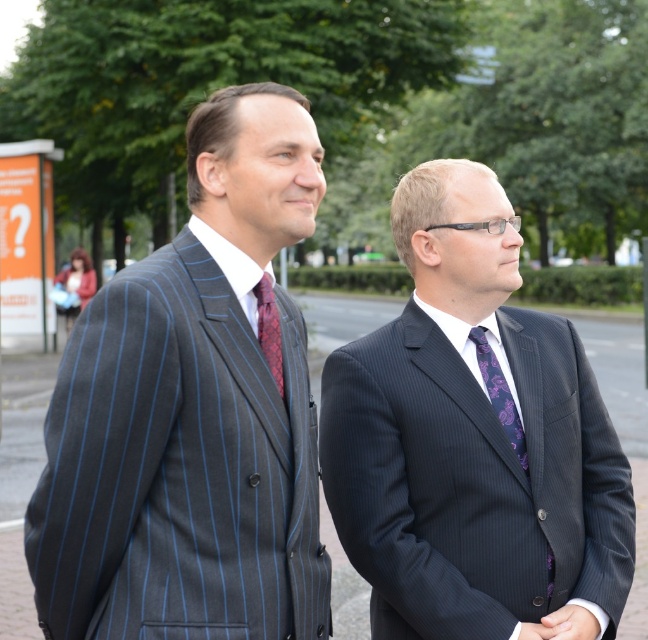
Question: Can you confirm if pinstriped suit at left is positioned below purple floral fabric tie at center?

Choices:
 (A) no
 (B) yes

Answer: (A)

Question: Based on their relative distances, which object is nearer to the dark pinstripe suit at center?

Choices:
 (A) pinstriped suit at left
 (B) purple floral fabric tie at center
 (C) red textured tie at center
 (D) purple silk tie at center

Answer: (D)

Question: Which object is the closest to the pinstriped suit at left?

Choices:
 (A) red textured tie at center
 (B) dark pinstripe suit at center

Answer: (A)

Question: Which object is positioned farthest from the purple silk tie at center?

Choices:
 (A) dark pinstripe suit at center
 (B) pinstriped suit at left

Answer: (B)

Question: Does dark pinstripe suit at center appear over purple floral fabric tie at center?

Choices:
 (A) no
 (B) yes

Answer: (B)

Question: Where is pinstriped suit at left located in relation to purple floral fabric tie at center in the image?

Choices:
 (A) below
 (B) above

Answer: (B)